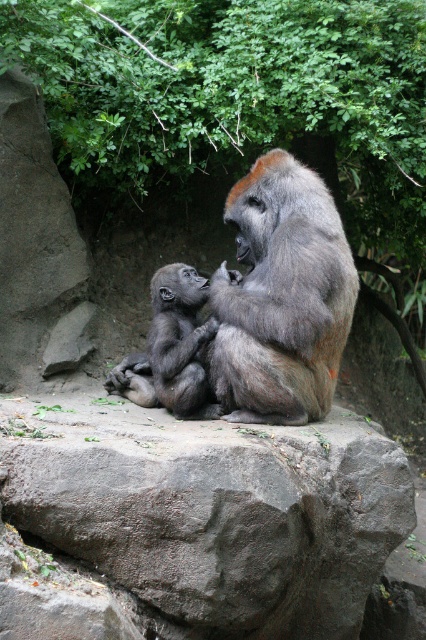
Between gray furry gorilla at center and gray furry baby gorilla at left, which one appears on the right side from the viewer's perspective?

gray furry gorilla at center

Does gray furry gorilla at center have a greater height compared to gray furry baby gorilla at left?

Yes.

At what (x,y) coordinates should I click in order to perform the action: click on gray furry gorilla at center. Please return your answer as a coordinate pair (x, y). Image resolution: width=426 pixels, height=640 pixels. Looking at the image, I should click on (282, 296).

Where is `gray furry gorilla at center`? gray furry gorilla at center is located at coordinates (282, 296).

Can you confirm if gray rough boulder at center is positioned to the right of gray furry baby gorilla at left?

Indeed, gray rough boulder at center is positioned on the right side of gray furry baby gorilla at left.

Is gray rough boulder at center thinner than gray furry baby gorilla at left?

In fact, gray rough boulder at center might be wider than gray furry baby gorilla at left.

Where is `gray rough boulder at center`? gray rough boulder at center is located at coordinates (212, 509).

Which is below, gray rough boulder at center or gray furry gorilla at center?

gray rough boulder at center

Which of these two, gray rough boulder at center or gray furry gorilla at center, stands taller?

gray furry gorilla at center

You are a GUI agent. You are given a task and a screenshot of the screen. Output one action in this format:
    pyautogui.click(x=<x>, y=<y>)
    Task: Click on the gray rough boulder at center
    The height and width of the screenshot is (640, 426).
    Given the screenshot: What is the action you would take?
    pyautogui.click(x=212, y=509)

At what (x,y) coordinates should I click in order to perform the action: click on gray rough boulder at center. Please return your answer as a coordinate pair (x, y). Image resolution: width=426 pixels, height=640 pixels. Looking at the image, I should click on (212, 509).